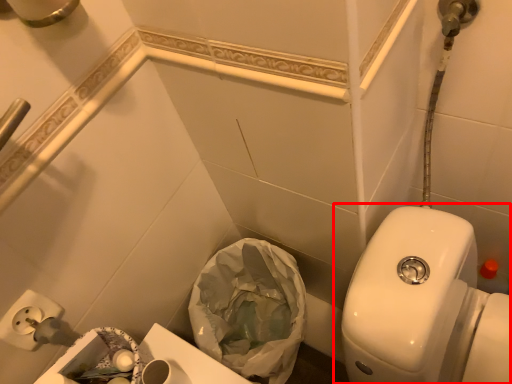
Question: From the image, what is the correct spatial relationship of toilet (annotated by the red box) in relation to garbage?

Choices:
 (A) right
 (B) left

Answer: (A)